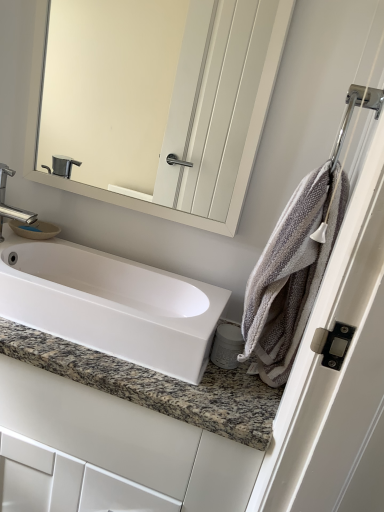
Question: Considering the relative positions of silver metallic faucet at left and chrome metallic towel bar at upper right in the image provided, is silver metallic faucet at left to the left of chrome metallic towel bar at upper right from the viewer's perspective?

Choices:
 (A) no
 (B) yes

Answer: (B)

Question: Is silver metallic faucet at left thinner than chrome metallic towel bar at upper right?

Choices:
 (A) yes
 (B) no

Answer: (A)

Question: From the image's perspective, is silver metallic faucet at left on top of chrome metallic towel bar at upper right?

Choices:
 (A) no
 (B) yes

Answer: (A)

Question: Can you confirm if silver metallic faucet at left is taller than chrome metallic towel bar at upper right?

Choices:
 (A) no
 (B) yes

Answer: (B)

Question: Can you confirm if silver metallic faucet at left is bigger than chrome metallic towel bar at upper right?

Choices:
 (A) yes
 (B) no

Answer: (A)

Question: From a real-world perspective, is silver metallic faucet at left located higher than chrome metallic towel bar at upper right?

Choices:
 (A) no
 (B) yes

Answer: (A)

Question: Is matte white mirror at upper center to the right of silver metallic faucet at left from the viewer's perspective?

Choices:
 (A) yes
 (B) no

Answer: (A)

Question: From a real-world perspective, is matte white mirror at upper center physically above silver metallic faucet at left?

Choices:
 (A) no
 (B) yes

Answer: (B)

Question: Is matte white mirror at upper center behind silver metallic faucet at left?

Choices:
 (A) no
 (B) yes

Answer: (A)

Question: Would you say matte white mirror at upper center is a long distance from silver metallic faucet at left?

Choices:
 (A) yes
 (B) no

Answer: (B)

Question: Does matte white mirror at upper center appear on the left side of silver metallic faucet at left?

Choices:
 (A) no
 (B) yes

Answer: (A)

Question: From the image's perspective, is matte white mirror at upper center below silver metallic faucet at left?

Choices:
 (A) yes
 (B) no

Answer: (B)

Question: Is gray textured towel at right oriented towards chrome metallic towel bar at upper right?

Choices:
 (A) yes
 (B) no

Answer: (B)